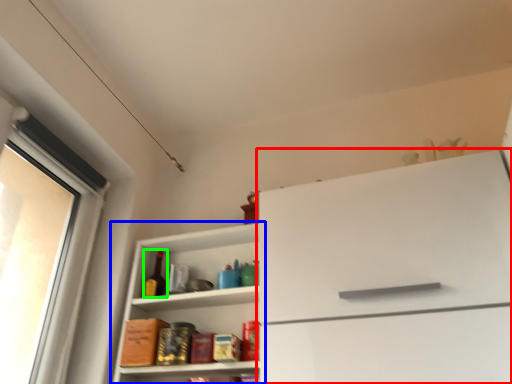
Question: Estimate the real-world distances between objects in this image. Which object is closer to cabinetry (highlighted by a red box), shelf (highlighted by a blue box) or bottle (highlighted by a green box)?

Choices:
 (A) shelf
 (B) bottle

Answer: (A)